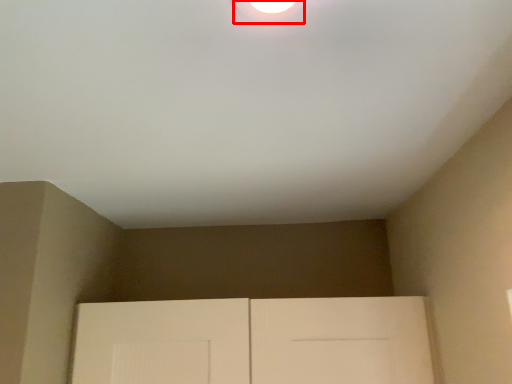
Question: From the image's perspective, considering the relative positions of droplight (annotated by the red box) and door in the image provided, where is droplight (annotated by the red box) located with respect to the staircase?

Choices:
 (A) above
 (B) below

Answer: (A)